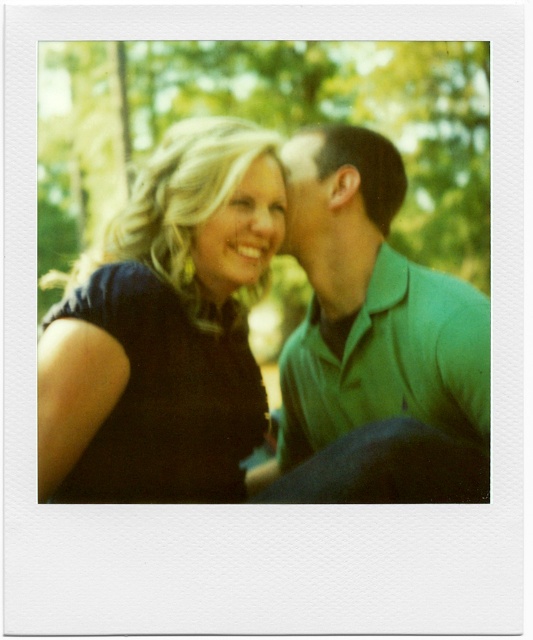
Question: Can you confirm if green smooth shirt at upper right is smaller than matte green forehead at upper center?

Choices:
 (A) no
 (B) yes

Answer: (A)

Question: Which point is farther to the camera?

Choices:
 (A) (166, 164)
 (B) (222, 225)
 (C) (300, 152)

Answer: (C)

Question: Which point is closer to the camera?

Choices:
 (A) (248, 204)
 (B) (82, 477)

Answer: (B)

Question: Estimate the real-world distances between objects in this image. Which object is farther from the matte black hair at center?

Choices:
 (A) matte green shirt at upper right
 (B) green smooth shirt at upper right

Answer: (B)

Question: Is green smooth shirt at upper right closer to camera compared to matte green shirt at upper right?

Choices:
 (A) yes
 (B) no

Answer: (A)

Question: In this image, where is black matte dress at upper left located relative to green smooth shirt at upper right?

Choices:
 (A) below
 (B) above

Answer: (B)